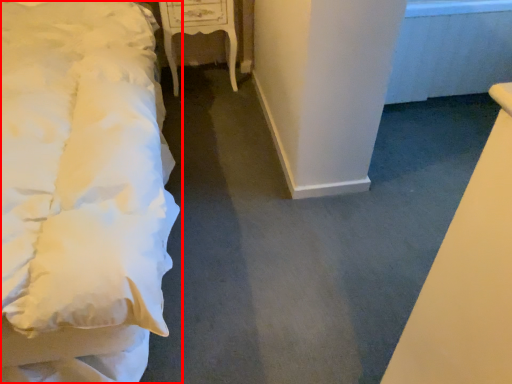
Question: Considering the relative positions of bed (annotated by the red box) and furniture in the image provided, where is bed (annotated by the red box) located with respect to the staircase?

Choices:
 (A) left
 (B) right

Answer: (A)